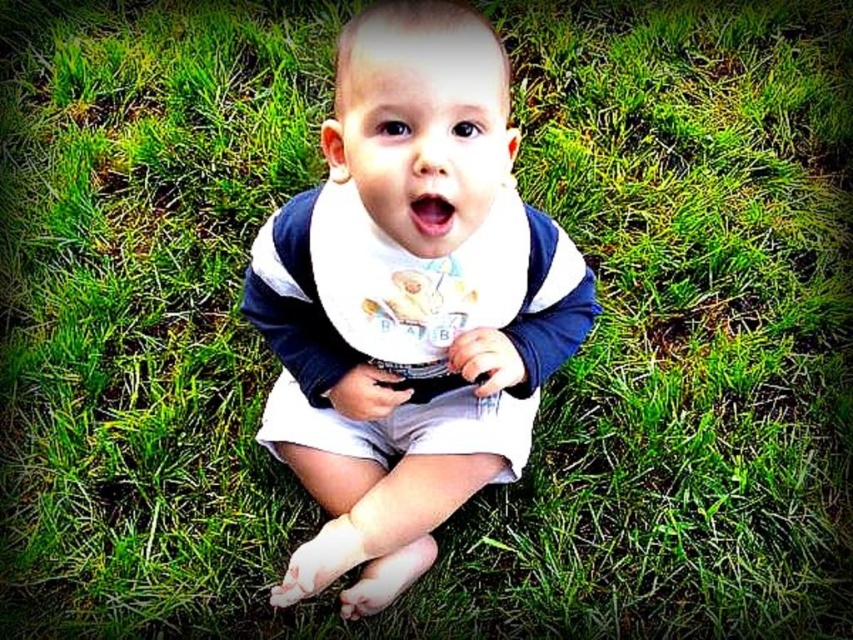
Question: From the image, what is the correct spatial relationship of white soft bib at center in relation to white fabric bib at center?

Choices:
 (A) below
 (B) above

Answer: (A)

Question: Is white soft bib at center to the right of white fabric bib at center from the viewer's perspective?

Choices:
 (A) yes
 (B) no

Answer: (B)

Question: Which object is farther from the camera taking this photo?

Choices:
 (A) white soft bib at center
 (B) white fabric bib at center

Answer: (B)

Question: Which of the following is the closest to the observer?

Choices:
 (A) (343, 321)
 (B) (527, 436)

Answer: (A)

Question: Can you confirm if white soft bib at center is positioned to the right of white fabric bib at center?

Choices:
 (A) no
 (B) yes

Answer: (A)